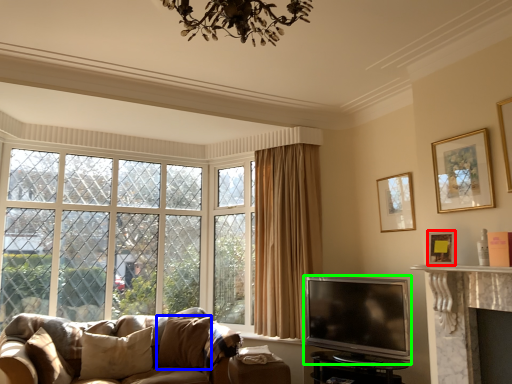
Question: Which object is the closest to the picture frame (highlighted by a red box)? Choose among these: pillow (highlighted by a blue box) or television (highlighted by a green box).

Choices:
 (A) pillow
 (B) television

Answer: (B)